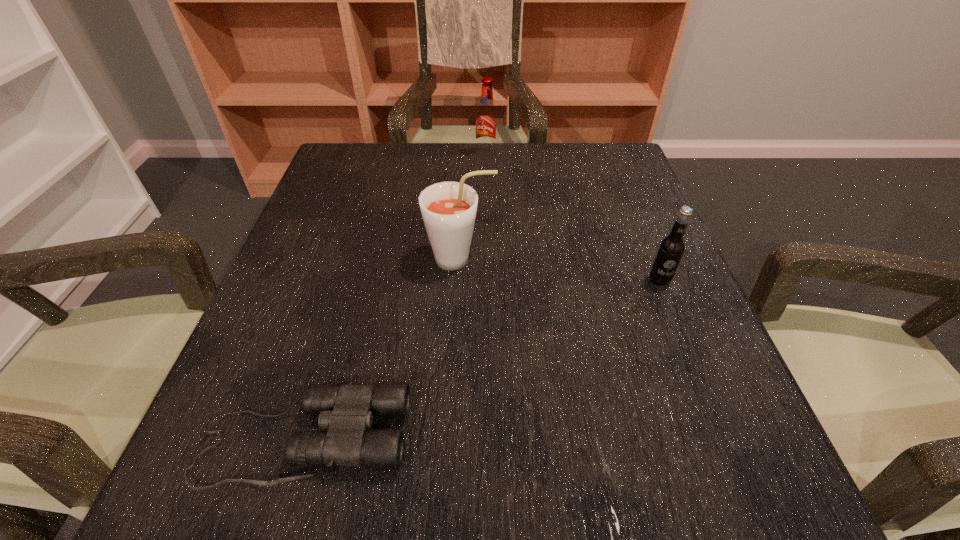
Where is `the farthest object`? This screenshot has height=540, width=960. the farthest object is located at coordinates (486, 118).

Identify the location of the rightmost object. This screenshot has height=540, width=960. (671, 248).

You are a GUI agent. You are given a task and a screenshot of the screen. Output one action in this format:
    pyautogui.click(x=<x>, y=<y>)
    Task: Click on the nearest object
    This screenshot has height=540, width=960.
    Given the screenshot: What is the action you would take?
    pyautogui.click(x=347, y=411)

Where is `binoculars`? The height and width of the screenshot is (540, 960). binoculars is located at coordinates (347, 411).

You are a GUI agent. You are given a task and a screenshot of the screen. Output one action in this format:
    pyautogui.click(x=<x>, y=<y>)
    Task: Click on the vacant space situated 0.160m on the front of the farthest object
    
    Given the screenshot: What is the action you would take?
    pyautogui.click(x=487, y=196)

Where is `free space located 0.160m on the label of the rightmost root beer`? The height and width of the screenshot is (540, 960). free space located 0.160m on the label of the rightmost root beer is located at coordinates (691, 361).

This screenshot has width=960, height=540. I want to click on blank space located 0.150m at the eyepiece of the nearest object, so click(514, 438).

This screenshot has width=960, height=540. I want to click on object at the far edge, so click(x=486, y=118).

The width and height of the screenshot is (960, 540). Find the location of `object present at the near edge`. object present at the near edge is located at coordinates (347, 411).

The width and height of the screenshot is (960, 540). What are the coordinates of `object that is at the left edge` in the screenshot? It's located at (347, 411).